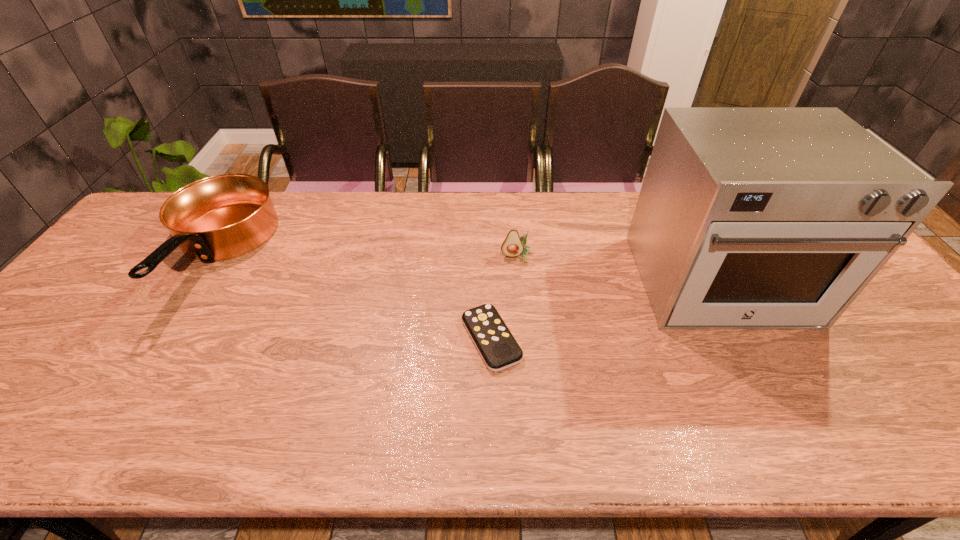
I want to click on object positioned at the far edge, so click(x=220, y=217).

At what (x,y) coordinates should I click in order to perform the action: click on object positioned at the left edge. Please return your answer as a coordinate pair (x, y). This screenshot has height=540, width=960. Looking at the image, I should click on (220, 217).

Where is `object that is at the far left corner`? object that is at the far left corner is located at coordinates (220, 217).

What are the coordinates of `vacant space at the far edge of the desktop` in the screenshot? It's located at (407, 224).

Image resolution: width=960 pixels, height=540 pixels. In the image, there is a desktop. Find the location of `vacant space at the near edge`. vacant space at the near edge is located at coordinates (442, 437).

The image size is (960, 540). What are the coordinates of `vacant area at the left edge of the desktop` in the screenshot? It's located at (170, 238).

In the image, there is a desktop. At what (x,y) coordinates should I click in order to perform the action: click on vacant space at the right edge. Please return your answer as a coordinate pair (x, y). Looking at the image, I should click on (869, 307).

Where is `free space at the far left corner of the desktop`? This screenshot has height=540, width=960. free space at the far left corner of the desktop is located at coordinates (169, 197).

Where is `free space between the toaster oven and the shortest object`? This screenshot has height=540, width=960. free space between the toaster oven and the shortest object is located at coordinates tap(605, 311).

Locate an element on the screen. This screenshot has height=540, width=960. free space between the shortest object and the leftmost object is located at coordinates (353, 298).